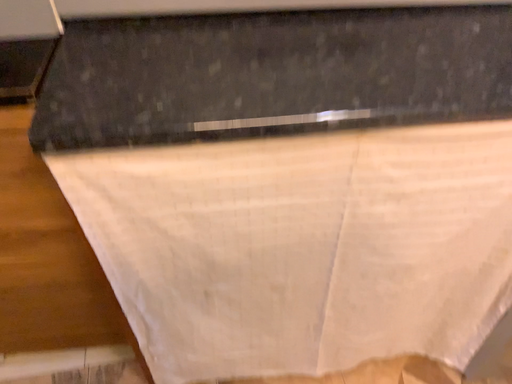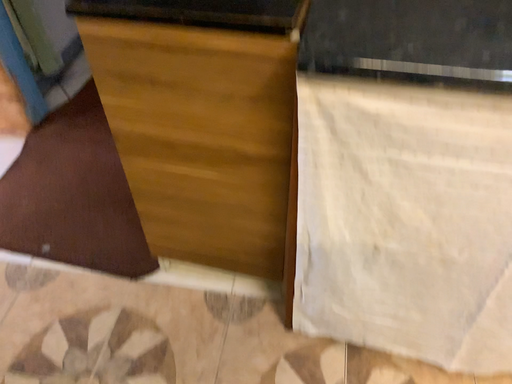
Question: How did the camera likely rotate when shooting the video?

Choices:
 (A) rotated left
 (B) rotated right

Answer: (A)